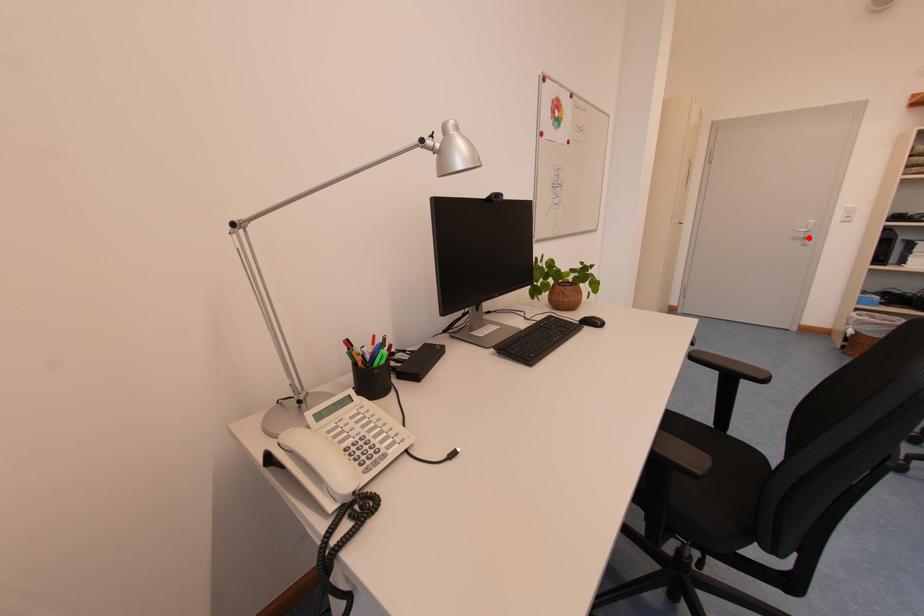
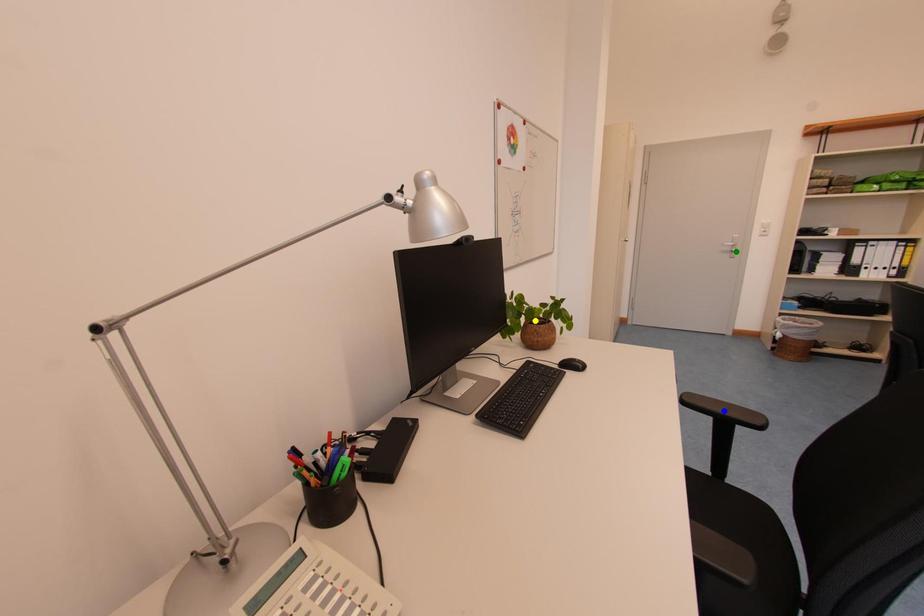
Question: I am providing you with two images of the same scene from different viewpoints. A red point is marked on the first image. You are given multiple points on the second image. Which point in image 2 is actually the same real-world point as the red point in image 1?

Choices:
 (A) blue point
 (B) green point
 (C) yellow point

Answer: (B)